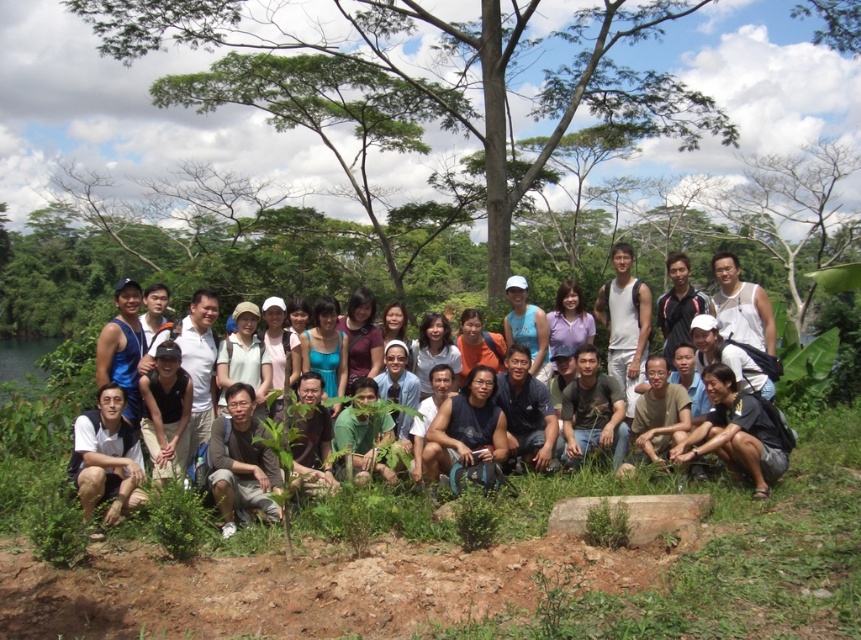
Question: Which object appears closest to the camera in this image?

Choices:
 (A) white cotton shirt at center
 (B) white matte shirt at lower left
 (C) green leafy tree at center

Answer: (B)

Question: Which point is closer to the camera taking this photo?

Choices:
 (A) 757,310
 (B) 493,253

Answer: (A)

Question: Does green leafy tree at center lie in front of white matte shirt at lower left?

Choices:
 (A) yes
 (B) no

Answer: (B)

Question: Can you confirm if white cotton shirt at center is smaller than white matte shirt at lower left?

Choices:
 (A) yes
 (B) no

Answer: (B)

Question: Which of these objects is positioned farthest from the green leafy tree at center?

Choices:
 (A) white cotton shirt at center
 (B) white matte shirt at lower left

Answer: (B)

Question: Is green leafy tree at center to the right of white cotton shirt at center from the viewer's perspective?

Choices:
 (A) no
 (B) yes

Answer: (B)